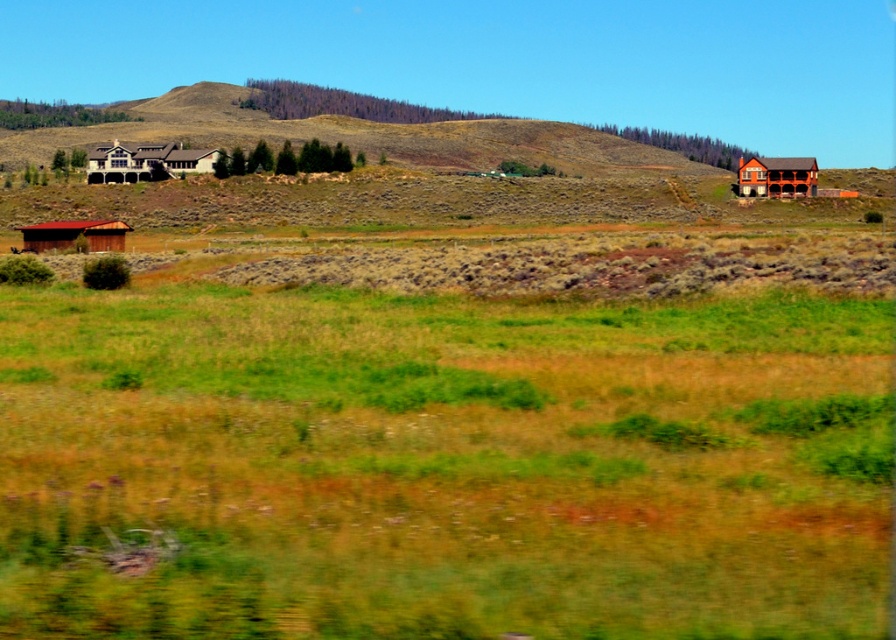
You are an architect designing a new subdivision and need to ensure proper spacing between homes. You observe the white wood house at left and the matte white house at upper left in the scene. Which house requires more horizontal space for construction due to its size?

The white wood house at left requires more horizontal space for construction because its width is larger than the matte white house at upper left.

You are a drone operator trying to capture aerial footage of the white wood house at left and the brown wooden hut at lower left. Based on their positions, which structure would appear higher in the frame when viewed from above?

The white wood house at left is positioned over the brown wooden hut at lower left, so when viewed from above, the white wood house at left would appear higher in the frame than the brown wooden hut at lower left.